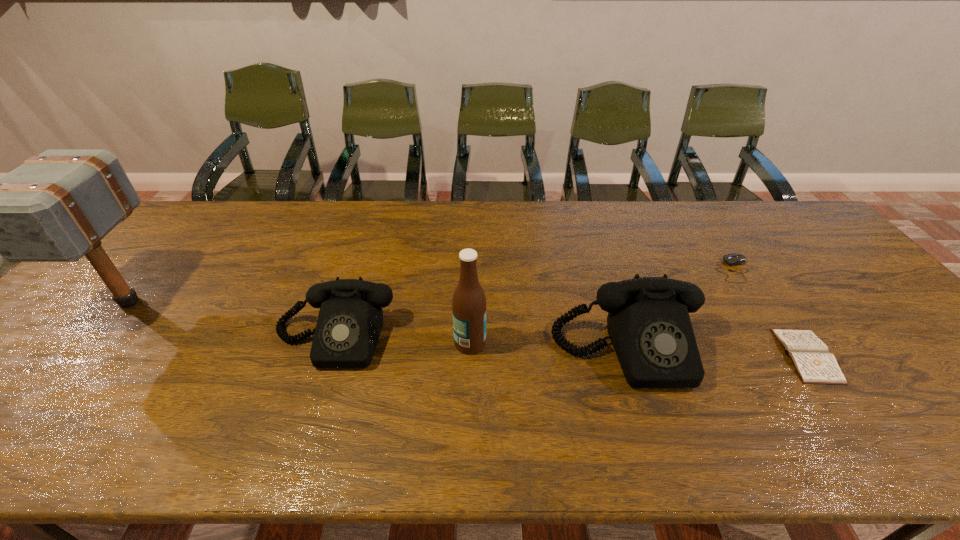
Please show where to add a telephone on the right while keeping spacing even. Please provide its 2D coordinates. Your answer should be formatted as a tuple, i.e. [(x, y)], where the tuple contains the x and y coordinates of a point satisfying the conditions above.

[(937, 363)]